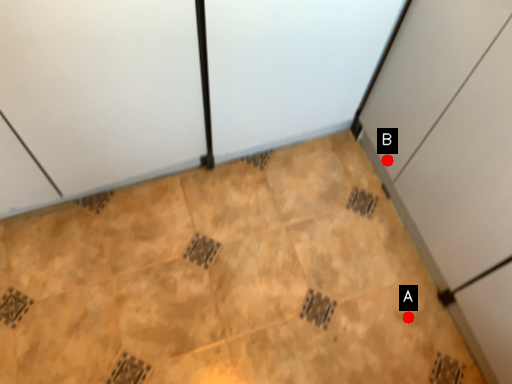
Question: Two points are circled on the image, labeled by A and B beside each circle. Among these points, which one is farthest from the camera?

Choices:
 (A) A is further
 (B) B is further

Answer: (B)